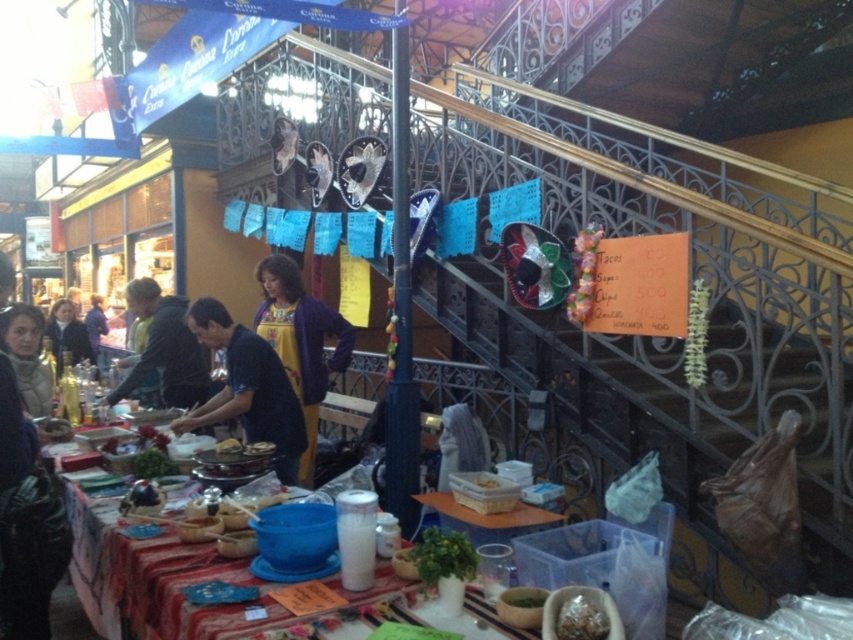
From the picture: You are organizing a food stall and need to arrange items on the table. The dark blue fabric at center and the dark blue sweater at left are both on the table. Which item takes up more space on the table?

The dark blue sweater at left occupies more space than the dark blue fabric at center.

You are a customer looking at the table with the dark blue fabric at center and the dark blue sweater at left. Which item is nearer to you?

The dark blue fabric at center is closer to the viewer than the dark blue sweater at left.